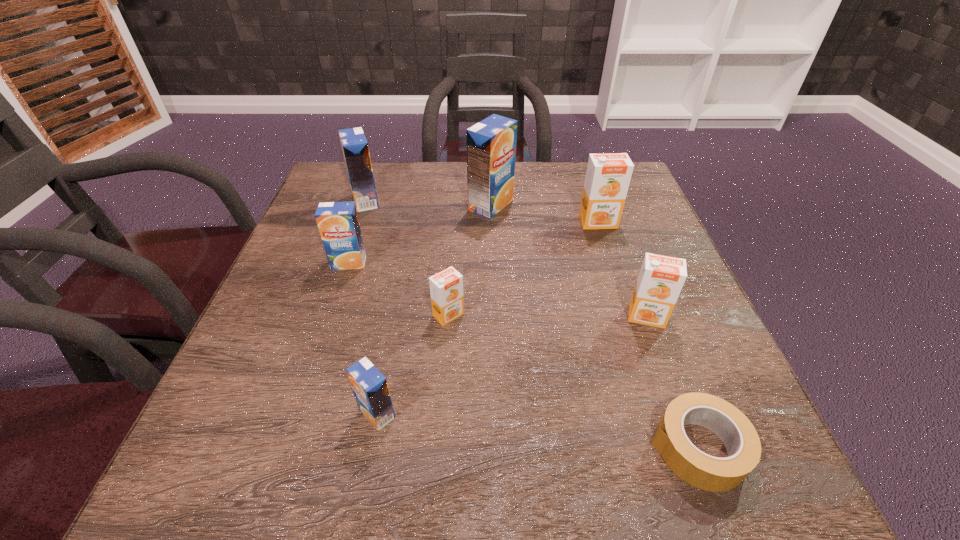
Locate an element on the screen. vacant position located at the edge of the duct tape is located at coordinates (386, 448).

This screenshot has height=540, width=960. In order to click on free point located at the edge of the duct tape in this screenshot , I will do `click(605, 448)`.

You are a GUI agent. You are given a task and a screenshot of the screen. Output one action in this format:
    pyautogui.click(x=<x>, y=<y>)
    Task: Click on the object that is at the near edge
    
    Given the screenshot: What is the action you would take?
    pyautogui.click(x=703, y=471)

The height and width of the screenshot is (540, 960). Identify the location of duct tape situated at the right edge. (703, 471).

Identify the location of object that is at the far left corner. (354, 145).

At what (x,y) coordinates should I click in order to perform the action: click on object that is at the near right corner. Please return your answer as a coordinate pair (x, y). Looking at the image, I should click on (703, 471).

In the image, there is a desktop. What are the coordinates of `vacant space at the far edge` in the screenshot? It's located at (518, 173).

This screenshot has height=540, width=960. What are the coordinates of `blank space at the near edge` in the screenshot? It's located at [x=361, y=441].

The height and width of the screenshot is (540, 960). In order to click on vacant space at the left edge of the desktop in this screenshot , I will do `click(335, 292)`.

Where is `vacant area at the right edge of the desktop`? The image size is (960, 540). vacant area at the right edge of the desktop is located at coordinates (600, 253).